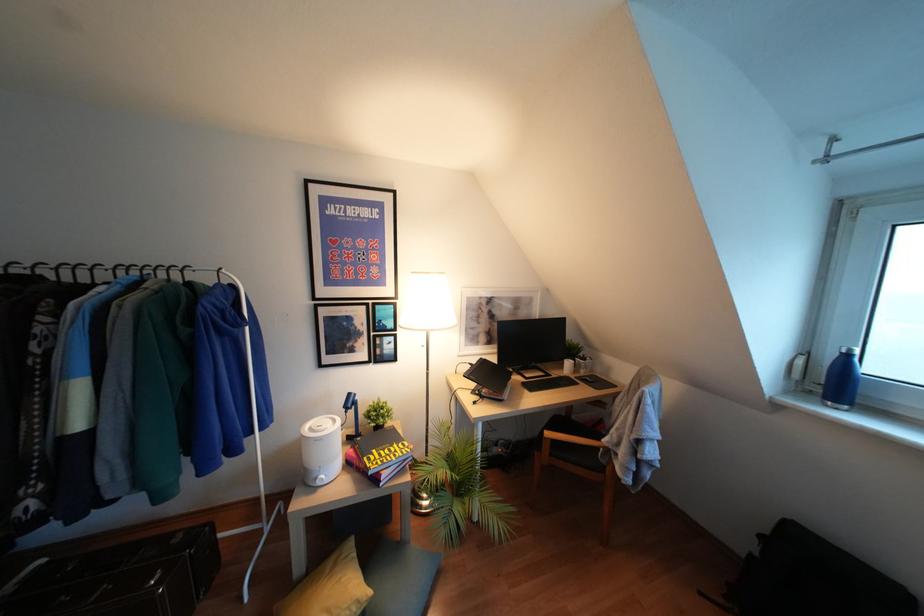
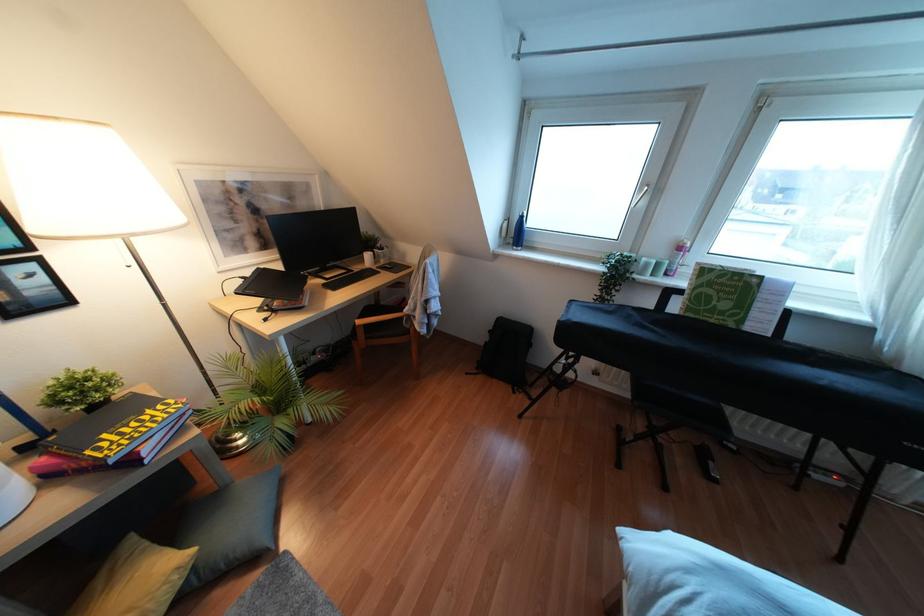
Based on the continuous images, in which direction is the camera rotating?

The camera rotated toward right-down.